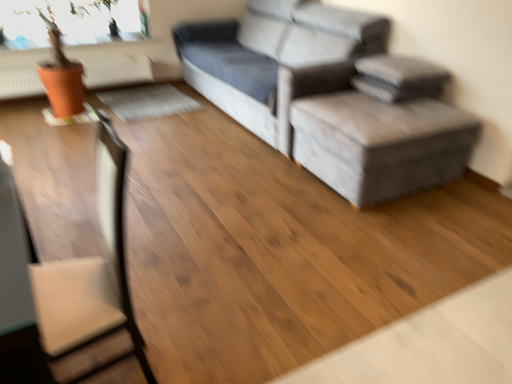
Where is `vacant space situated on the left part of gray fabric ottoman at center`? The height and width of the screenshot is (384, 512). vacant space situated on the left part of gray fabric ottoman at center is located at coordinates (253, 176).